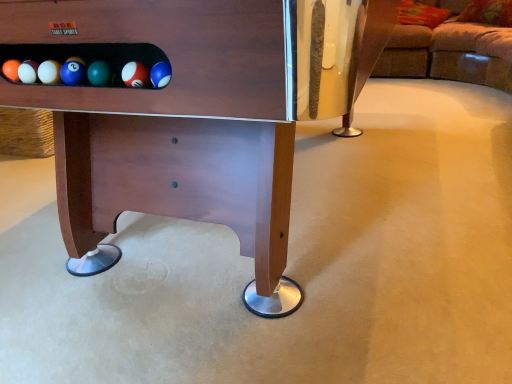
The image size is (512, 384). What do you see at coordinates (450, 51) in the screenshot?
I see `brown fabric couch at upper right` at bounding box center [450, 51].

At what (x,y) coordinates should I click in order to perform the action: click on brown fabric couch at upper right. Please return your answer as a coordinate pair (x, y). This screenshot has height=384, width=512. Looking at the image, I should click on (450, 51).

Describe the element at coordinates (198, 113) in the screenshot. I see `wooden pool table at center` at that location.

Identify the location of wooden pool table at center. The height and width of the screenshot is (384, 512). click(198, 113).

The image size is (512, 384). Identify the location of brown fabric couch at upper right. (450, 51).

Based on their positions, is brown fabric couch at upper right located to the left or right of wooden pool table at center?

Clearly, brown fabric couch at upper right is on the right of wooden pool table at center in the image.

Considering the positions of objects brown fabric couch at upper right and wooden pool table at center in the image provided, who is in front, brown fabric couch at upper right or wooden pool table at center?

wooden pool table at center.

Is point (448, 79) positioned before point (152, 10)?

No, (448, 79) is behind (152, 10).

From the image's perspective, which is above, brown fabric couch at upper right or wooden pool table at center?

brown fabric couch at upper right.

From a real-world perspective, is brown fabric couch at upper right below wooden pool table at center?

Yes.

Considering the relative sizes of brown fabric couch at upper right and wooden pool table at center in the image provided, is brown fabric couch at upper right thinner than wooden pool table at center?

In fact, brown fabric couch at upper right might be wider than wooden pool table at center.

Can you confirm if brown fabric couch at upper right is taller than wooden pool table at center?

In fact, brown fabric couch at upper right may be shorter than wooden pool table at center.

Considering the sizes of objects brown fabric couch at upper right and wooden pool table at center in the image provided, who is smaller, brown fabric couch at upper right or wooden pool table at center?

brown fabric couch at upper right.

Is brown fabric couch at upper right surrounding wooden pool table at center?

Actually, wooden pool table at center is outside brown fabric couch at upper right.

Is there a large distance between brown fabric couch at upper right and wooden pool table at center?

That's right, there is a large distance between brown fabric couch at upper right and wooden pool table at center.

Is brown fabric couch at upper right aimed at wooden pool table at center?

Yes.

What's the angular difference between brown fabric couch at upper right and wooden pool table at center's facing directions?

The facing directions of brown fabric couch at upper right and wooden pool table at center are 90.6 degrees apart.

This screenshot has width=512, height=384. Find the location of `furniture above the brown fabric couch at upper right (from a real-world perspective)`. furniture above the brown fabric couch at upper right (from a real-world perspective) is located at coordinates (198, 113).

Considering the relative positions of wooden pool table at center and brown fabric couch at upper right in the image provided, is wooden pool table at center to the left of brown fabric couch at upper right from the viewer's perspective?

Yes.

Which object is further away from the camera taking this photo, wooden pool table at center or brown fabric couch at upper right?

Positioned behind is brown fabric couch at upper right.

Is point (260, 218) closer to camera compared to point (458, 35)?

Yes, point (260, 218) is in front of point (458, 35).

From the image's perspective, is wooden pool table at center on brown fabric couch at upper right?

No.

From a real-world perspective, is wooden pool table at center physically above brown fabric couch at upper right?

Indeed, from a real-world perspective, wooden pool table at center stands above brown fabric couch at upper right.

Between wooden pool table at center and brown fabric couch at upper right, which one has larger width?

Wider between the two is brown fabric couch at upper right.

Which of these two, wooden pool table at center or brown fabric couch at upper right, stands taller?

wooden pool table at center is taller.

Which of these two, wooden pool table at center or brown fabric couch at upper right, is smaller?

brown fabric couch at upper right.

Is wooden pool table at center surrounding brown fabric couch at upper right?

No, brown fabric couch at upper right is not a part of wooden pool table at center.

Is there a large distance between wooden pool table at center and brown fabric couch at upper right?

wooden pool table at center is far away from brown fabric couch at upper right.

Is wooden pool table at center facing towards brown fabric couch at upper right?

No, wooden pool table at center is not oriented towards brown fabric couch at upper right.

How different are the orientations of wooden pool table at center and brown fabric couch at upper right in degrees?

90.6 degrees.

The image size is (512, 384). Identify the location of furniture that appears in front of the brown fabric couch at upper right. (198, 113).

Locate an element on the screen. furniture below the brown fabric couch at upper right (from the image's perspective) is located at coordinates (198, 113).

Locate an element on the screen. furniture to the left of brown fabric couch at upper right is located at coordinates (198, 113).